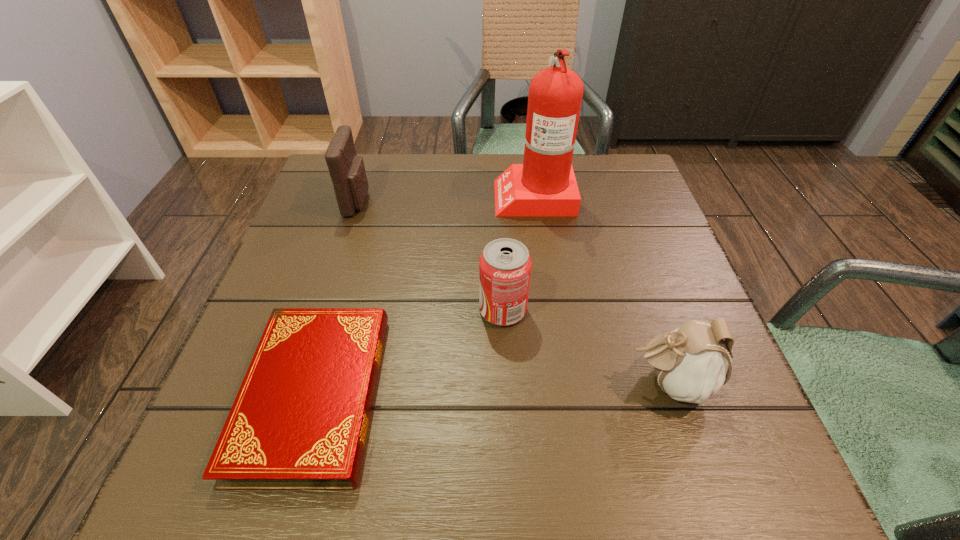
You are a GUI agent. You are given a task and a screenshot of the screen. Output one action in this format:
    pyautogui.click(x=<x>, y=<y>)
    Task: Click on the vacant space situated on the back of the soda can
    The image size is (960, 540).
    Given the screenshot: What is the action you would take?
    pyautogui.click(x=500, y=251)

What are the coordinates of `vacant position located 0.380m on the front-facing side of the rightmost object` in the screenshot? It's located at click(396, 383).

Where is `blank space located 0.210m on the front-facing side of the rightmost object`? blank space located 0.210m on the front-facing side of the rightmost object is located at coordinates (500, 383).

Find the location of a particular element. This screenshot has height=540, width=960. blank area located 0.380m on the front-facing side of the rightmost object is located at coordinates (396, 383).

At what (x,y) coordinates should I click in order to perform the action: click on fire extinguisher that is positioned at the far edge. Please return your answer as a coordinate pair (x, y). Looking at the image, I should click on (544, 185).

This screenshot has width=960, height=540. I want to click on pouch that is at the far edge, so click(347, 171).

At what (x,y) coordinates should I click in order to perform the action: click on object positioned at the near edge. Please return your answer as a coordinate pair (x, y). This screenshot has width=960, height=540. Looking at the image, I should click on (300, 419).

At what (x,y) coordinates should I click in order to perform the action: click on pouch at the left edge. Please return your answer as a coordinate pair (x, y). Looking at the image, I should click on (347, 171).

Identify the location of hardback book situated at the left edge. (300, 419).

This screenshot has height=540, width=960. I want to click on object that is at the right edge, so click(692, 362).